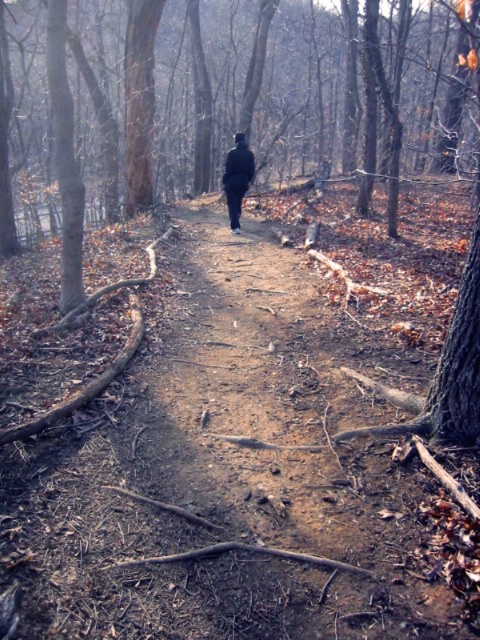
Question: Which of the following is the closest to the observer?

Choices:
 (A) (219, 461)
 (B) (239, 227)

Answer: (A)

Question: Can you confirm if dirt path at center is thinner than dark matte coat at center?

Choices:
 (A) yes
 (B) no

Answer: (B)

Question: Is dirt path at center behind dark matte coat at center?

Choices:
 (A) no
 (B) yes

Answer: (A)

Question: Can you confirm if dirt path at center is positioned above dark matte coat at center?

Choices:
 (A) no
 (B) yes

Answer: (A)